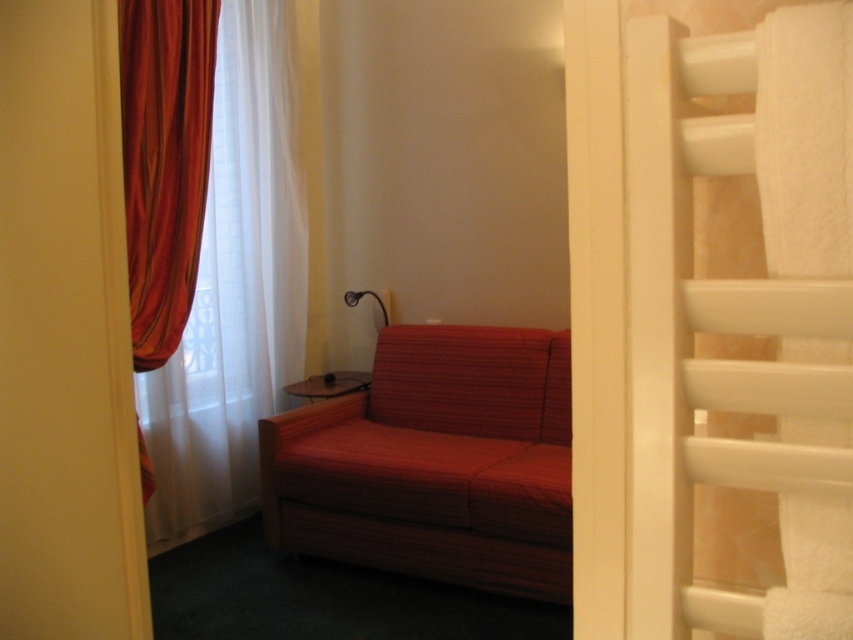
Question: Which of the following is the closest to the observer?

Choices:
 (A) (221, 353)
 (B) (401, 337)

Answer: (A)

Question: Which point is farther to the camera?

Choices:
 (A) wooden pillow at center
 (B) matte red pillow at center
 (C) red fabric couch at lower left

Answer: (A)

Question: Is red fabric couch at lower left to the right of velvet-like red curtain at left from the viewer's perspective?

Choices:
 (A) no
 (B) yes

Answer: (B)

Question: Can you confirm if velvet orange curtain at left is positioned below wooden pillow at center?

Choices:
 (A) no
 (B) yes

Answer: (A)

Question: Among these objects, which one is nearest to the camera?

Choices:
 (A) metallic black lamp at upper center
 (B) matte red pillow at center
 (C) velvet-like red curtain at left

Answer: (C)

Question: Where is red fabric couch at lower left located in relation to velvet orange curtain at left in the image?

Choices:
 (A) below
 (B) above

Answer: (A)